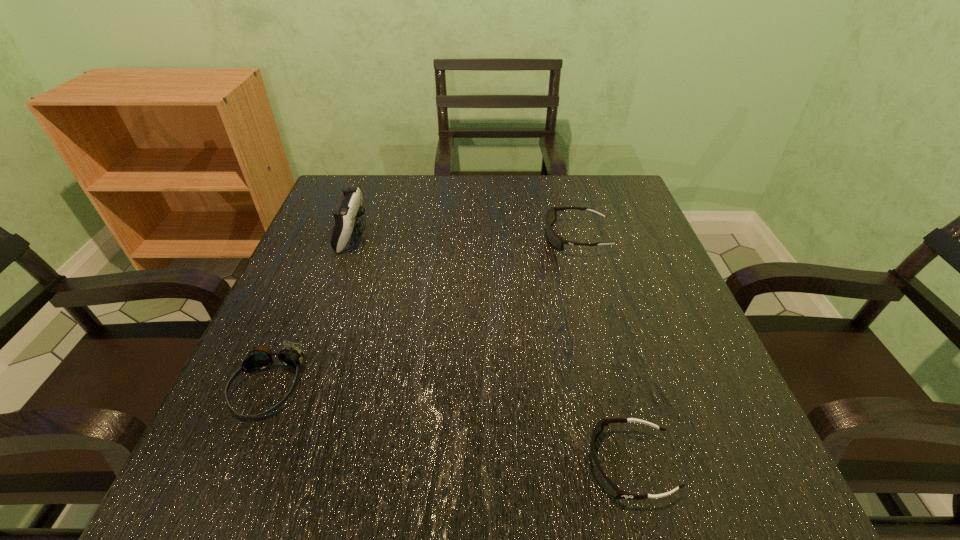
What are the coordinates of `the tallest object` in the screenshot? It's located at (346, 217).

In order to click on the farthest goggles in this screenshot , I will do `click(555, 240)`.

The image size is (960, 540). Find the location of `the second nearest object`. the second nearest object is located at coordinates (259, 357).

Locate an element on the screen. This screenshot has height=540, width=960. the second farthest goggles is located at coordinates click(x=259, y=357).

Find the location of a particular element. the nearest object is located at coordinates (612, 489).

Where is `the shortest object`? The width and height of the screenshot is (960, 540). the shortest object is located at coordinates pyautogui.click(x=612, y=489).

You are a GUI agent. You are given a task and a screenshot of the screen. Output one action in this format:
    pyautogui.click(x=<x>, y=<y>)
    Task: Click on the free region located on the front-facing side of the tallest object
    This screenshot has height=540, width=960.
    Given the screenshot: What is the action you would take?
    pyautogui.click(x=443, y=234)

Where is `vacant region located 0.380m on the lenses of the farthest goggles`? vacant region located 0.380m on the lenses of the farthest goggles is located at coordinates (381, 237).

Find the location of `vacant space located 0.370m on the lenses of the farthest goggles`. vacant space located 0.370m on the lenses of the farthest goggles is located at coordinates (385, 237).

Find the location of a particular element. vacant point located on the lenses of the farthest goggles is located at coordinates (385, 237).